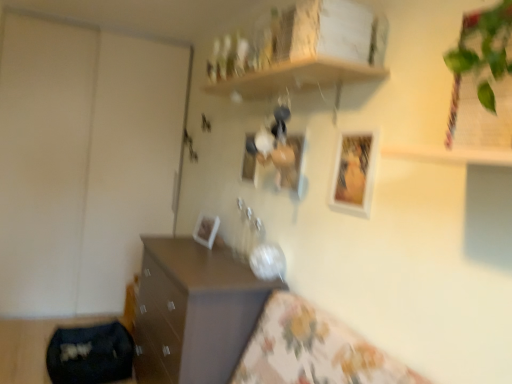
Find the location of `vacant space in front of white plastic picture frame at center, which is the 1th picture frame from back to front`. vacant space in front of white plastic picture frame at center, which is the 1th picture frame from back to front is located at coordinates (211, 251).